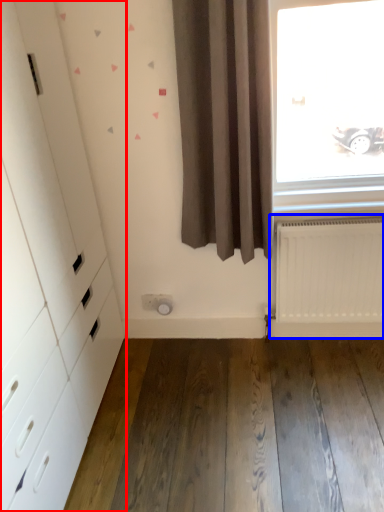
Question: Which object is closer to the camera taking this photo, dresser (highlighted by a red box) or radiator (highlighted by a blue box)?

Choices:
 (A) dresser
 (B) radiator

Answer: (A)